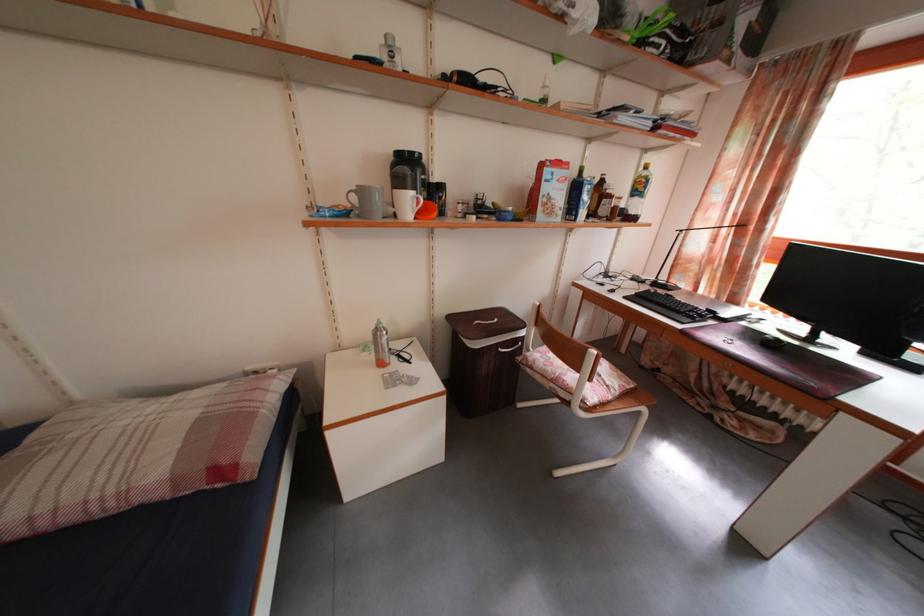
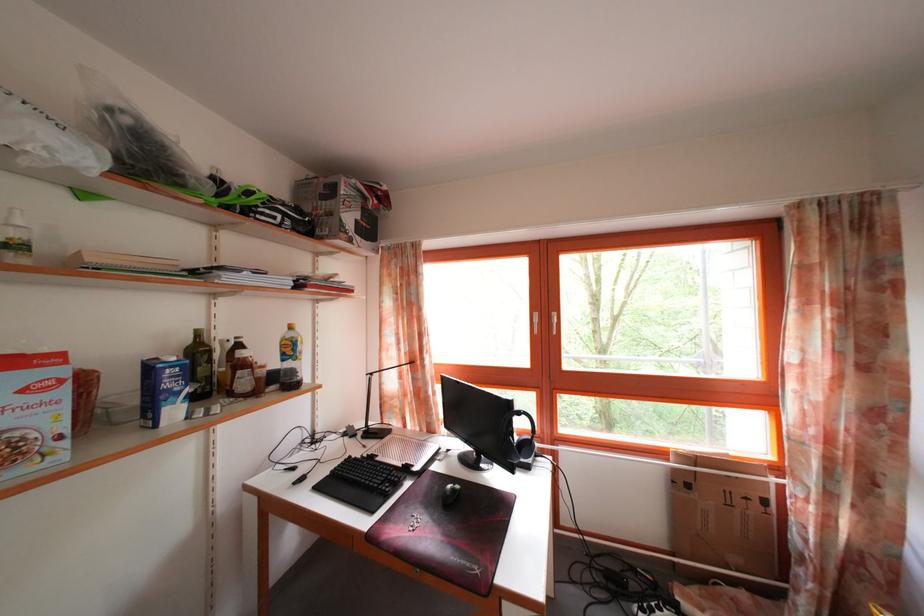
The first image is from the beginning of the video and the second image is from the end. How did the camera likely rotate when shooting the video?

The rotation direction of the camera is right-up.